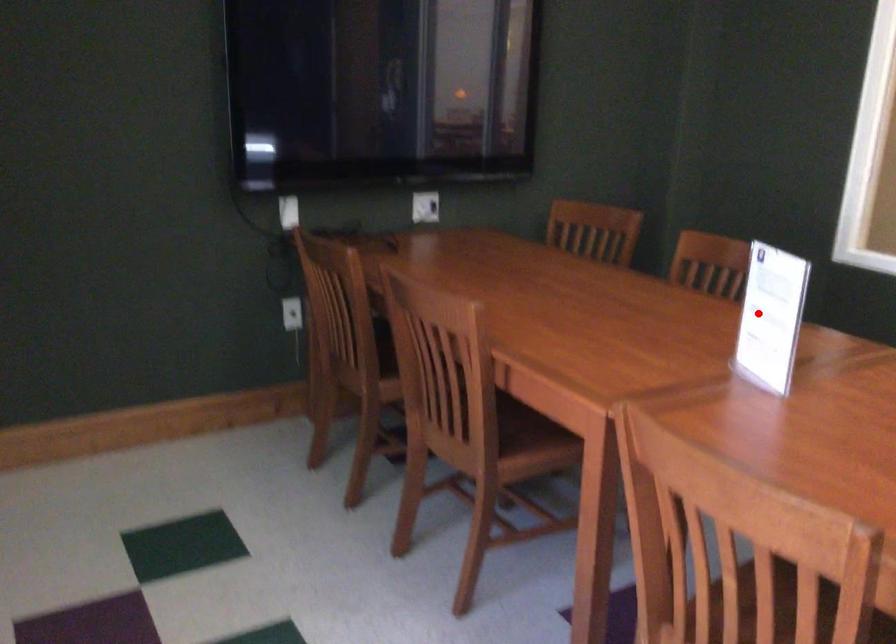
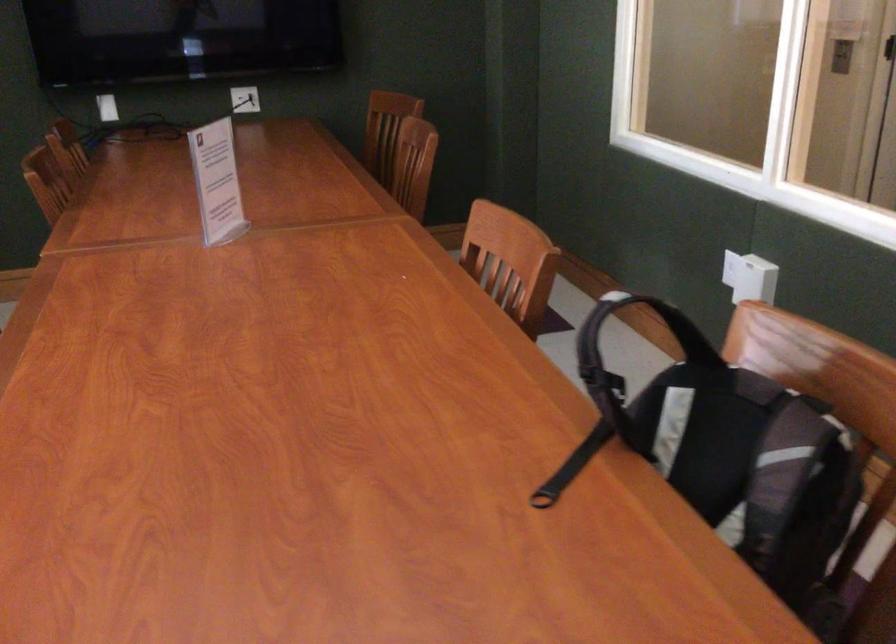
The point at the highlighted location is marked in the first image. Where is the corresponding point in the second image?

(217, 182)